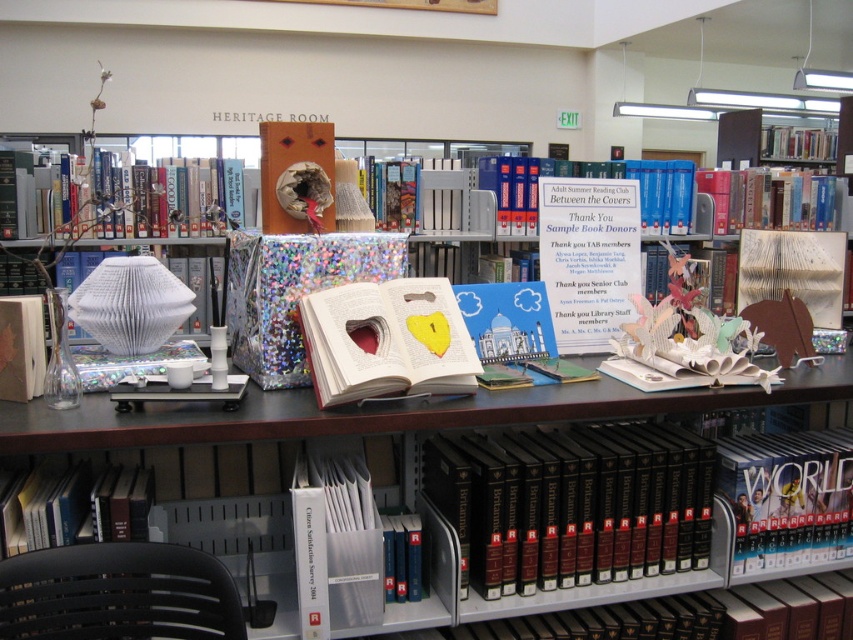
Question: Among these points, which one is farthest from the camera?

Choices:
 (A) (781, 150)
 (B) (622, 164)

Answer: (A)

Question: Which point is farther from the camera taking this photo?

Choices:
 (A) (762, 173)
 (B) (779, 476)
 (C) (204, 188)

Answer: (A)

Question: Is matte paper book at center to the right of hardcover book at left from the viewer's perspective?

Choices:
 (A) yes
 (B) no

Answer: (A)

Question: Is open book at center smaller than matte paper book at center?

Choices:
 (A) no
 (B) yes

Answer: (A)

Question: Which of the following is the closest to the observer?

Choices:
 (A) open book at center
 (B) hardcover books at upper right

Answer: (A)

Question: Is the position of open book at center more distant than that of hardcover book at lower right?

Choices:
 (A) yes
 (B) no

Answer: (B)